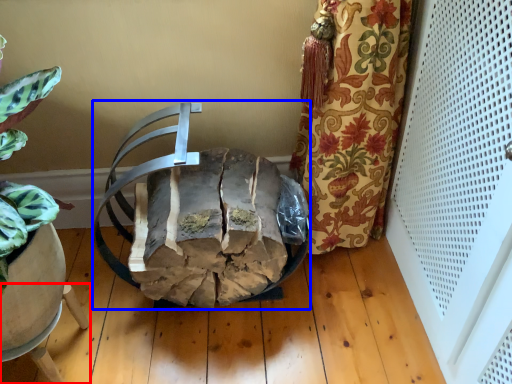
Question: Which of the following is the closest to the observer, furniture (highlighted by a red box) or chair (highlighted by a blue box)?

Choices:
 (A) furniture
 (B) chair

Answer: (B)